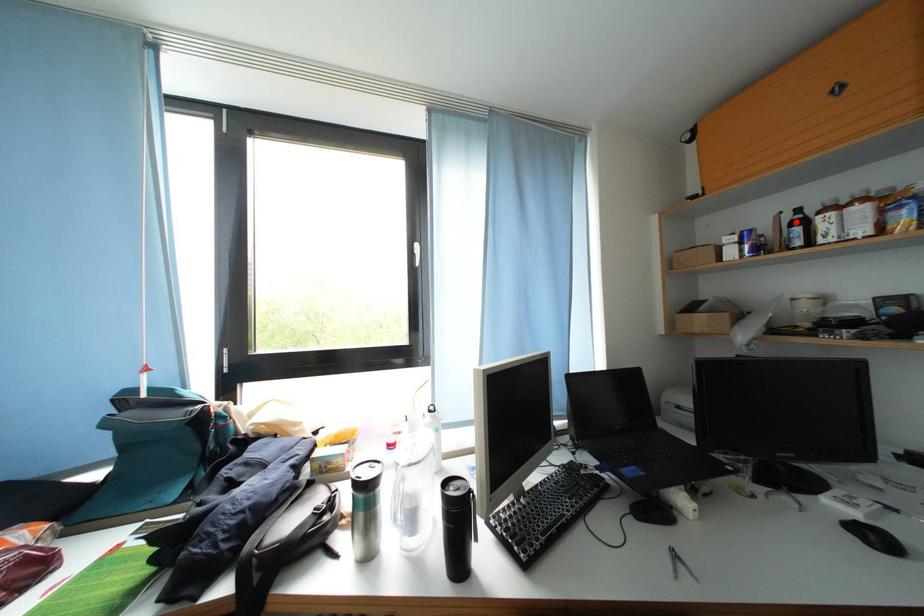
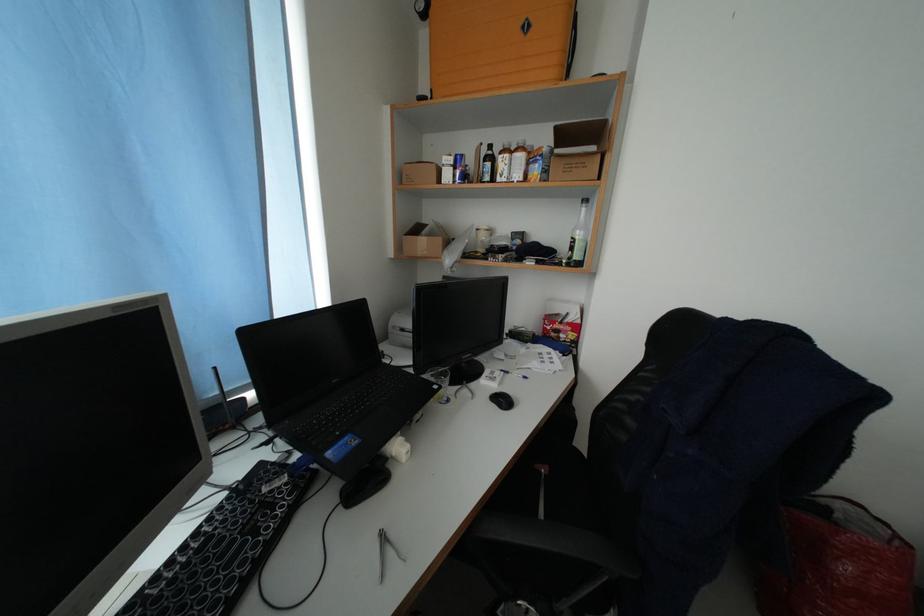
Question: I am providing you with two images of the same scene from different viewpoints. A red point is marked on the first image. Can you still see the location of the red point in image 2?

Choices:
 (A) Yes
 (B) No

Answer: (A)